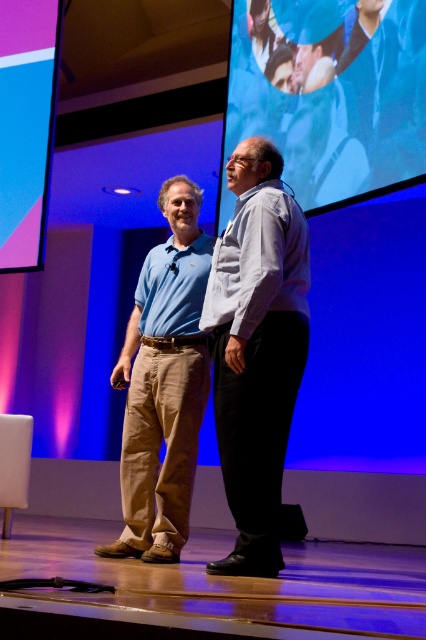
Question: Among these objects, which one is farthest from the camera?

Choices:
 (A) light blue shirt at center
 (B) blue fabric at upper center
 (C) matte blue shirt at center

Answer: (C)

Question: Which point is closer to the camera taking this photo?

Choices:
 (A) (204, 289)
 (B) (330, 131)

Answer: (A)

Question: Which object is the farthest from the blue fabric at upper center?

Choices:
 (A) light blue shirt at center
 (B) matte blue shirt at center

Answer: (B)

Question: Can you confirm if blue fabric at upper center is positioned below light blue shirt at center?

Choices:
 (A) no
 (B) yes

Answer: (A)

Question: Is blue fabric at upper center further to camera compared to matte blue shirt at center?

Choices:
 (A) no
 (B) yes

Answer: (A)

Question: Does light blue shirt at center appear under matte blue shirt at center?

Choices:
 (A) no
 (B) yes

Answer: (A)